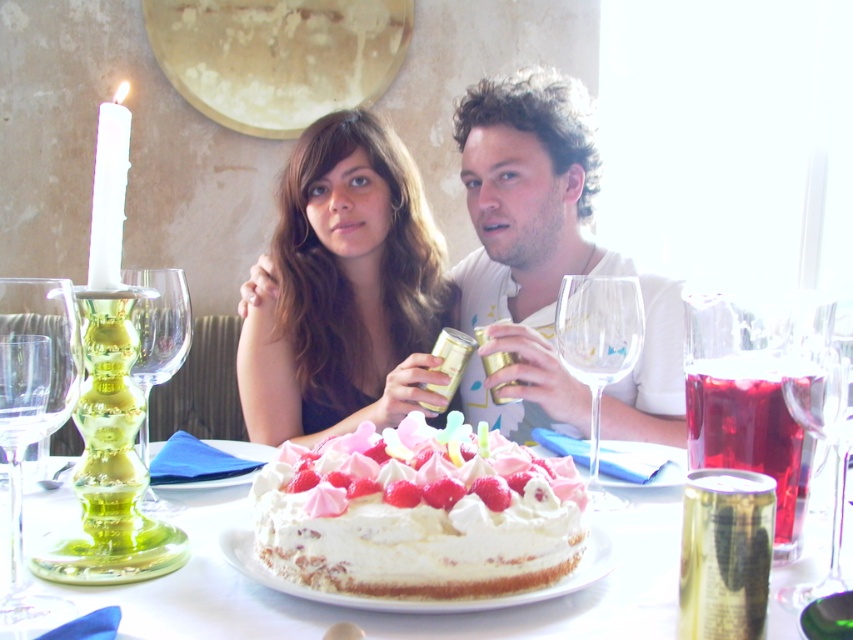
You are a guest at this table and want to reach for the transparent glass wine glass at left and the white wax candle at left. Which one is shorter?

The transparent glass wine glass at left is shorter than the white wax candle at left.

You are a server at the restaurant and need to place a dessert menu between the transparent glass wine glass at left and the white wax candle at left. Which object should you move to make space?

The transparent glass wine glass at left has a lesser width compared to the white wax candle at left, so you should move the transparent glass wine glass at left to make space for the dessert menu.